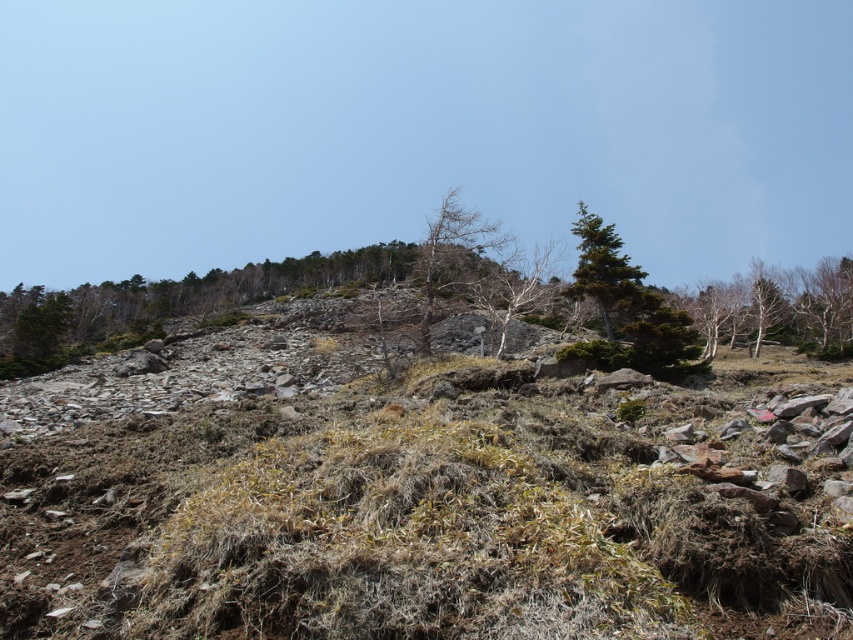
You are an environmental scientist studying the landscape. You observe the bare bark trees at upper right and the green textured tree at upper center. Which tree is closer to your current position?

The bare bark trees at upper right are closer to you than the green textured tree at upper center because they are positioned further to the viewer in the image.

You are an environmental researcher studying tree growth in this area. You observe the bare wood tree at center and the green textured tree at upper center. Which tree would you expect to have a wider trunk based on their sizes?

The bare wood tree at center is larger in size than the green textured tree at upper center, so it would have a wider trunk.